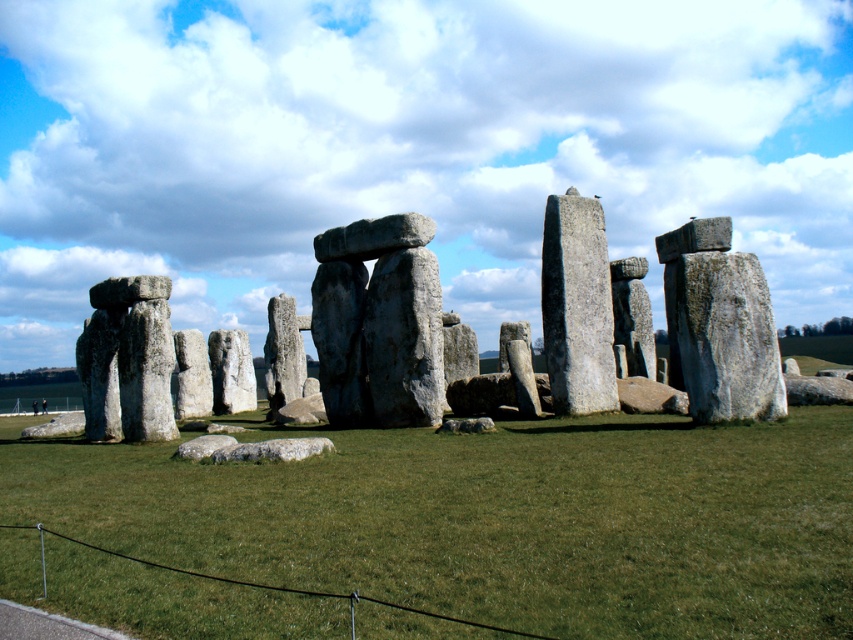
Question: Where is green grass at center located in relation to gray stone monolith at center in the image?

Choices:
 (A) right
 (B) left

Answer: (A)

Question: Which point is closer to the camera?

Choices:
 (A) gray stone pillar at center
 (B) gray stone monolith at right
 (C) green grass at center

Answer: (C)

Question: Which object is the closest to the gray stone pillar at center?

Choices:
 (A) gray stone monolith at center
 (B) green grass at center
 (C) gray stone pillars at center

Answer: (C)

Question: Is green grass at center to the left of gray stone pillar at left from the viewer's perspective?

Choices:
 (A) no
 (B) yes

Answer: (A)

Question: From the image, what is the correct spatial relationship of gray stone pillar at center in relation to gray stone pillar at left?

Choices:
 (A) left
 (B) right

Answer: (B)

Question: Which object is the farthest from the gray stone pillars at center?

Choices:
 (A) gray stone pillar at center
 (B) gray stone monolith at center

Answer: (A)